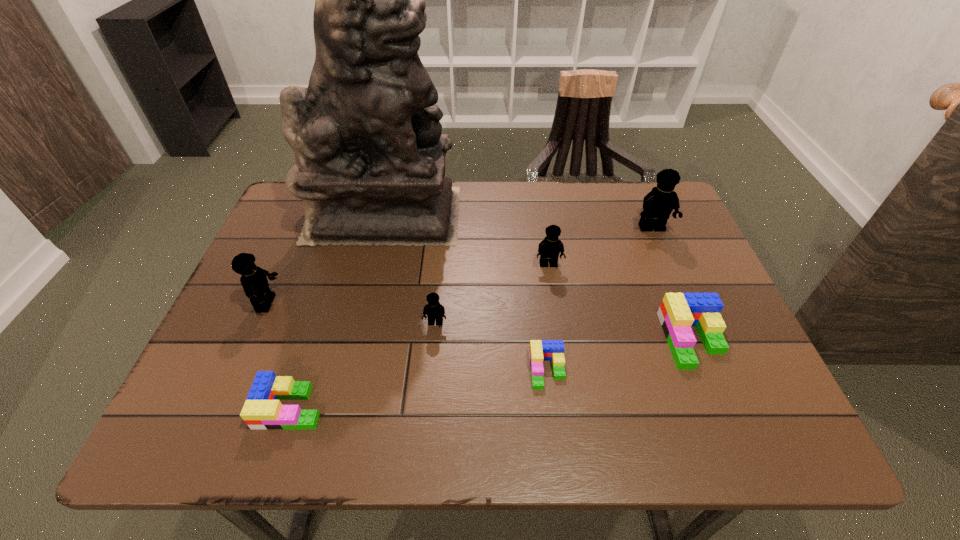
What are the coordinates of `the tallest object` in the screenshot? It's located at (369, 166).

Image resolution: width=960 pixels, height=540 pixels. I want to click on the biggest yellow Lego, so click(x=658, y=204).

The image size is (960, 540). I want to click on the farthest yellow Lego, so click(658, 204).

This screenshot has width=960, height=540. Find the location of `the third tallest object`. the third tallest object is located at coordinates (254, 281).

The image size is (960, 540). Identify the location of the leftmost yellow Lego. (254, 281).

Identify the location of the third yellow Lego from left to right. The width and height of the screenshot is (960, 540). (549, 249).

Locate an element on the screen. This screenshot has width=960, height=540. the third farthest object is located at coordinates (549, 249).

Where is `the fourth shortest object`? the fourth shortest object is located at coordinates (435, 311).

Image resolution: width=960 pixels, height=540 pixels. I want to click on the smallest yellow Lego, so click(x=435, y=311).

This screenshot has width=960, height=540. Identify the location of the fifth tallest Lego. (679, 311).